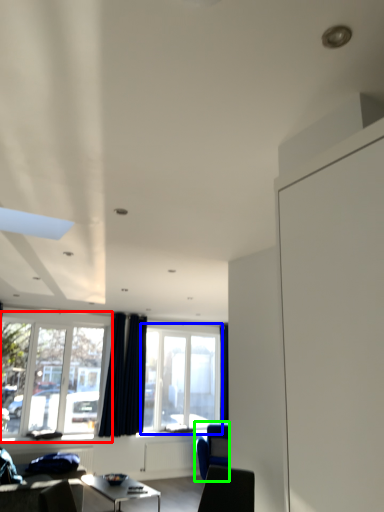
Question: Estimate the real-world distances between objects in this image. Which object is farther from window (highlighted by a red box), window (highlighted by a blue box) or armchair (highlighted by a green box)?

Choices:
 (A) window
 (B) armchair

Answer: (B)